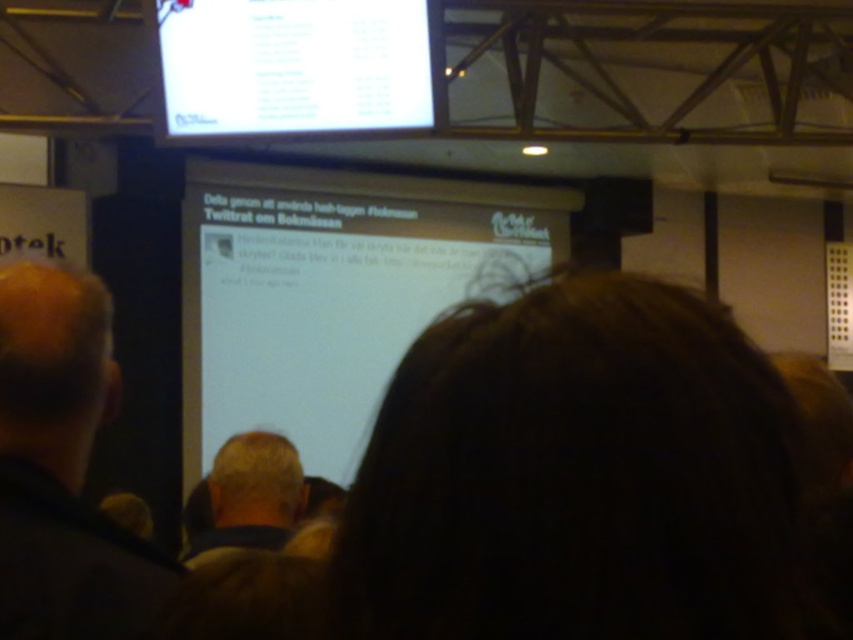
Question: Is white matte screen at center closer to camera compared to blonde hair at center?

Choices:
 (A) no
 (B) yes

Answer: (A)

Question: Can you confirm if white matte screen at center is bigger than dark brown hair at center?

Choices:
 (A) no
 (B) yes

Answer: (B)

Question: Which point is closer to the camera taking this photo?

Choices:
 (A) (206, 516)
 (B) (231, 65)

Answer: (A)

Question: Which object appears closest to the camera in this image?

Choices:
 (A) white matte screen at center
 (B) white glossy screen at upper center

Answer: (B)

Question: Does white matte screen at center have a smaller size compared to white glossy screen at upper center?

Choices:
 (A) yes
 (B) no

Answer: (B)

Question: Which point is closer to the camera?

Choices:
 (A) white glossy screen at upper center
 (B) white matte screen at center
 (C) blonde hair at center

Answer: (C)